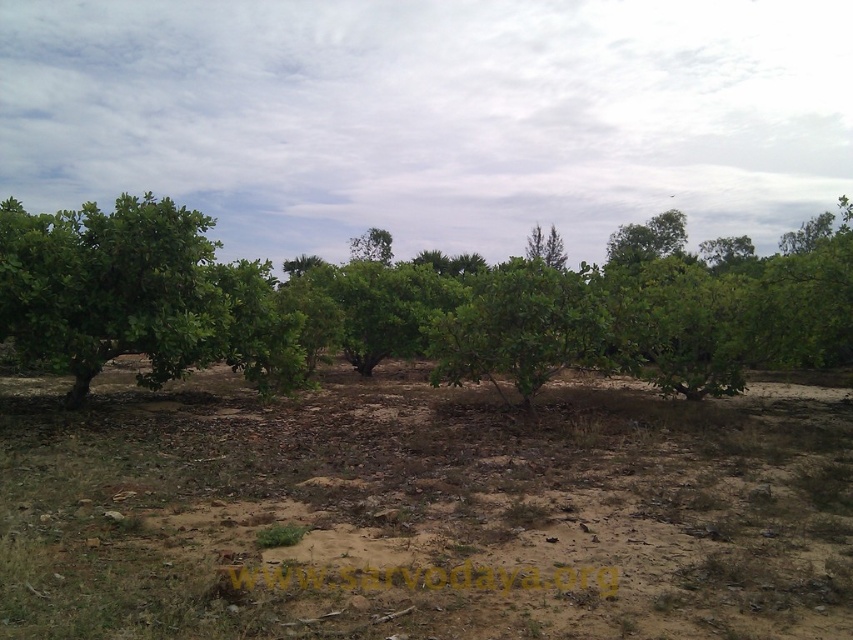
You are a farmer checking the health of your crops. You notice the brown soil at center and the green leafy tree at left. Which object is located lower in the image?

The brown soil at center is located lower in the image as it is positioned below the green leafy tree at left.

You are a gardener who needs to water the green leafy tree at center. You have a watering can that can spray water up to 4 meters. Can you water the tree from your current position at the brown soil at center without moving closer?

The brown soil at center is 3.94 meters from the green leafy tree at center. Since the watering can can spray up to 4 meters, you can water the tree from your current position at the brown soil at center without moving closer.

You are a farmer checking the health of your crops. You notice the brown soil at center and the green leafy tree at center. Which object is located to the left of the other?

The brown soil at center is positioned on the left side of green leafy tree at center.